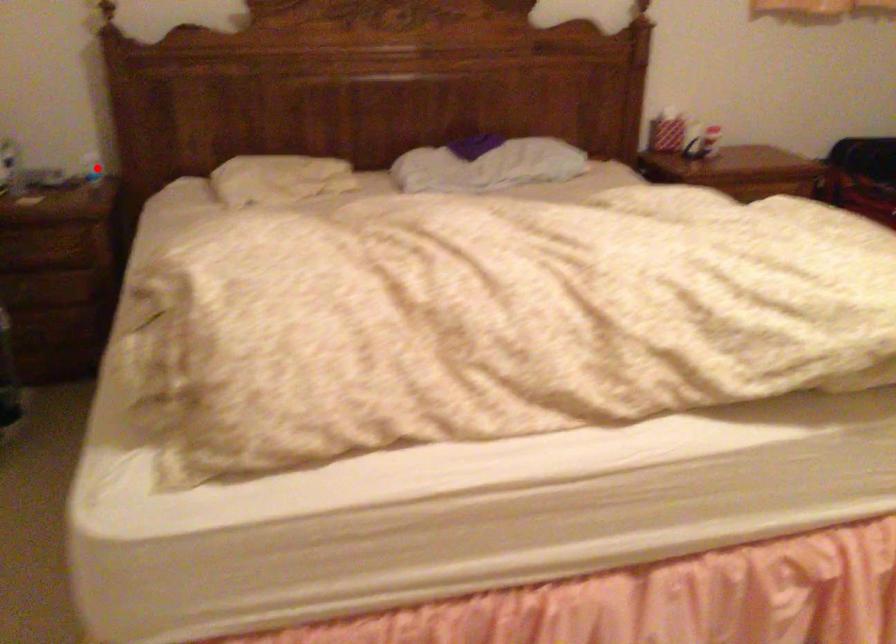
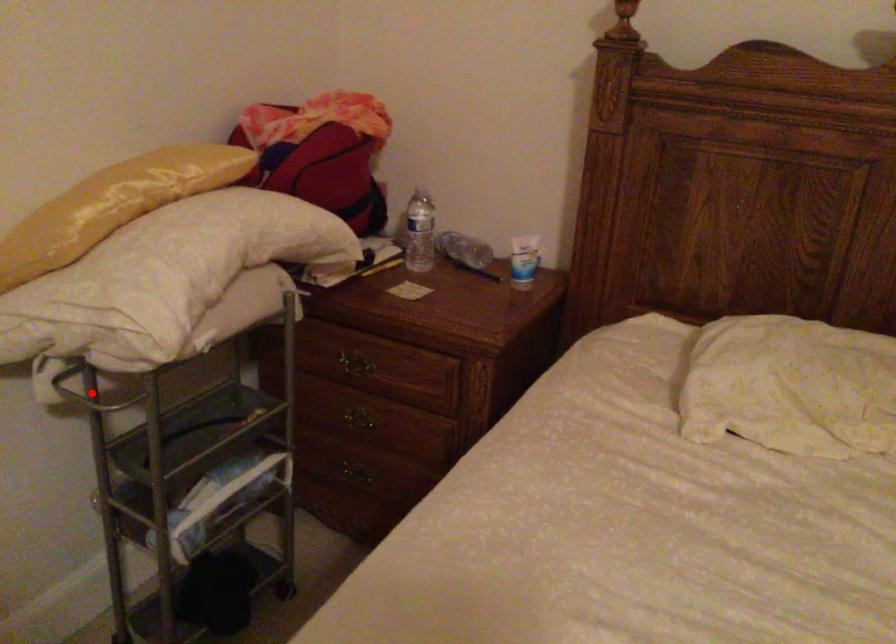
I am providing you with two images of the same scene from different viewpoints. A red point is marked on the first image and another point is marked on the second image. Are the points marked in image1 and image2 representing the same 3D position?

No